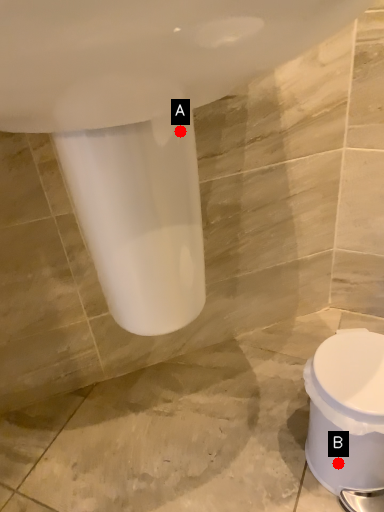
Question: Two points are circled on the image, labeled by A and B beside each circle. Which of the following is the closest to the observer?

Choices:
 (A) A is closer
 (B) B is closer

Answer: (A)